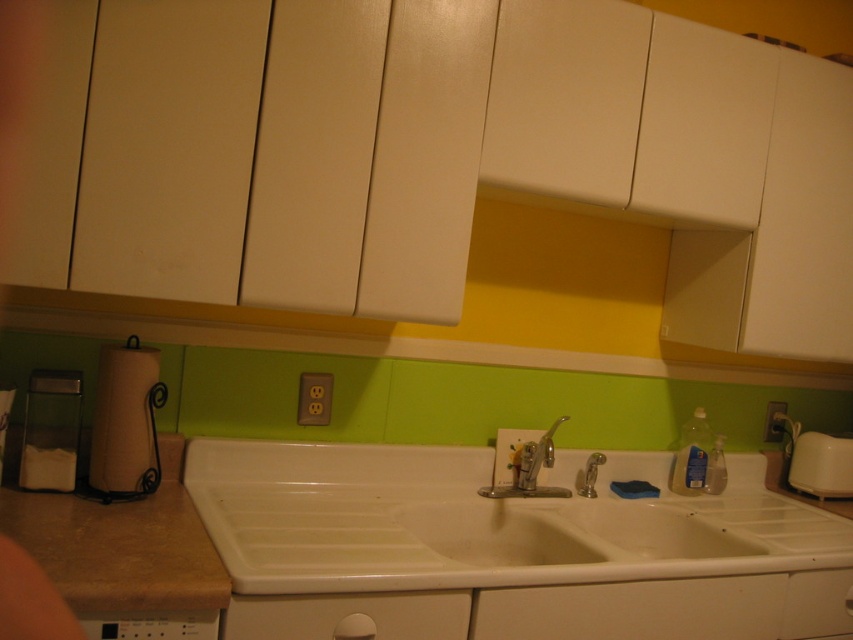
Question: Estimate the real-world distances between objects in this image. Which object is closer to the white plastic toaster at right?

Choices:
 (A) blue matte sponge at sink
 (B) matte brown paper towel holder at lower left
 (C) black plastic dishwasher at lower left
 (D) silver metallic faucet at center

Answer: (A)

Question: Where is matte brown paper towel holder at lower left located in relation to black plastic dishwasher at lower left in the image?

Choices:
 (A) below
 (B) above

Answer: (B)

Question: Which point is farther to the camera?

Choices:
 (A) white plastic toaster at right
 (B) blue matte sponge at sink

Answer: (A)

Question: Can you confirm if white matte drawer at center is positioned to the right of blue matte sponge at sink?

Choices:
 (A) no
 (B) yes

Answer: (A)

Question: Which point appears farthest from the camera in this image?

Choices:
 (A) (701, 618)
 (B) (547, 435)
 (C) (131, 392)

Answer: (B)

Question: Does white matte drawer at center appear under blue matte sponge at sink?

Choices:
 (A) yes
 (B) no

Answer: (A)